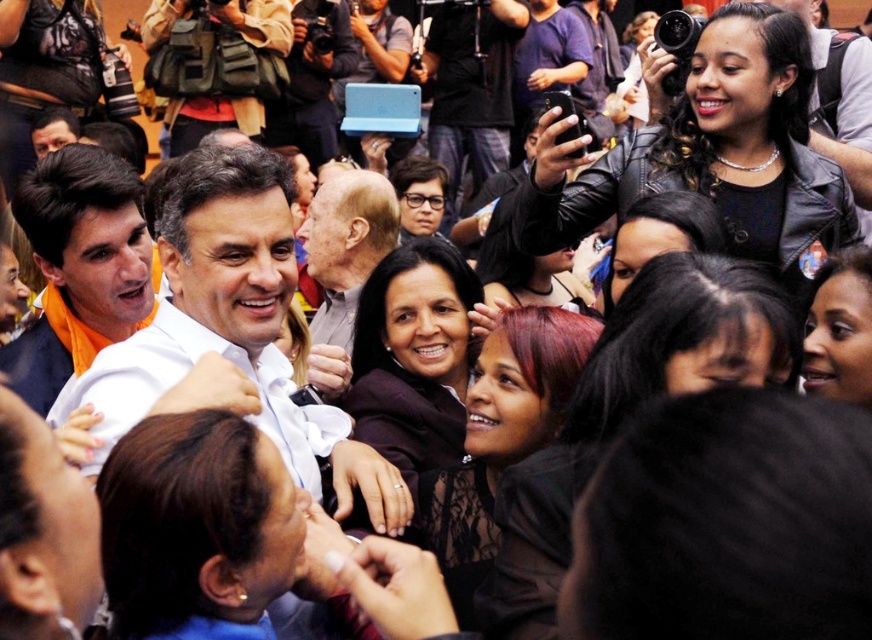
You are a photographer at the event and want to capture a photo of both the dark brown hair at center and the gray hair at center. However, you can only focus on one of them clearly. Which one should you choose to ensure it is in focus?

You should focus on the dark brown hair at center because it is closer to the viewer than the gray hair at center, so focusing on it will ensure it is in focus while the other may be slightly blurred.

You are standing at the point labeled point (387, 465) and want to move forward to the front of the crowd. Which direction should you move relative to the point labeled point (511, 618)?

Since point (387, 465) is behind point (511, 618), you should move forward towards the direction of point (511, 618) to reach the front of the crowd.